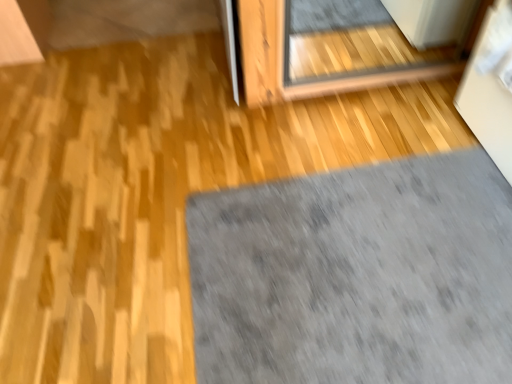
Image resolution: width=512 pixels, height=384 pixels. What are the coordinates of `gray textured bath mat at lower right` in the screenshot? It's located at (357, 276).

Measure the distance between gray textured bath mat at lower right and camera.

gray textured bath mat at lower right is 1.07 meters away from camera.

What do you see at coordinates (357, 276) in the screenshot?
I see `gray textured bath mat at lower right` at bounding box center [357, 276].

I want to click on gray textured bath mat at lower right, so click(357, 276).